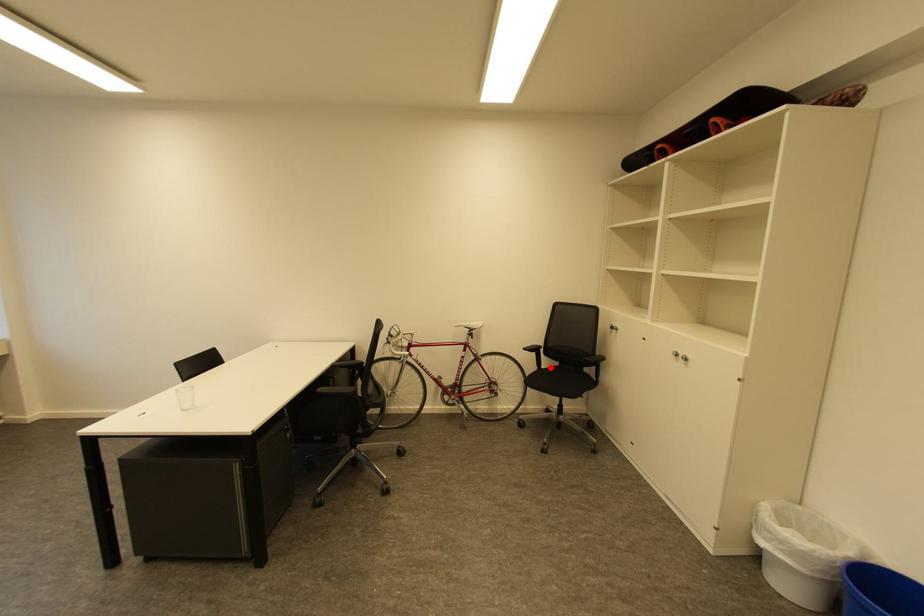
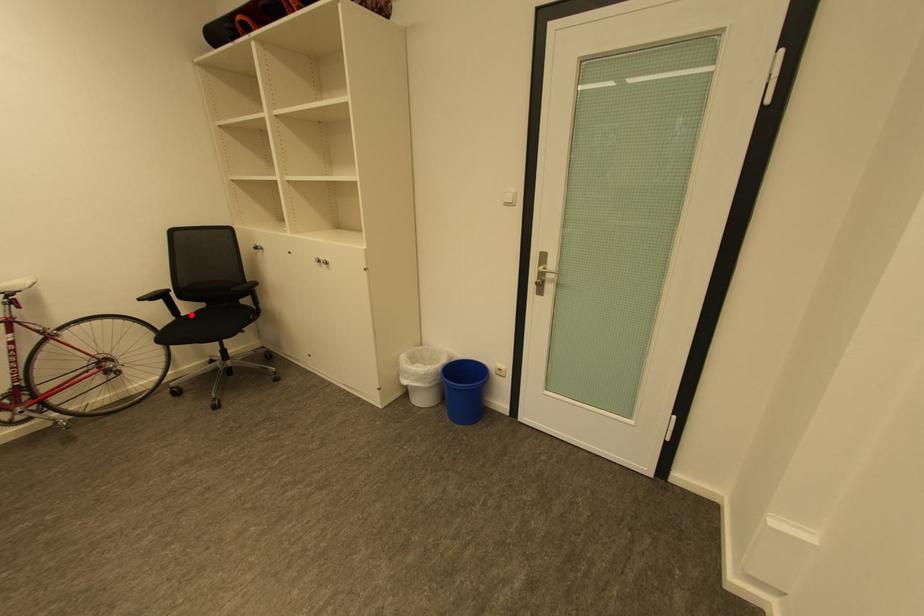
I am providing you with two images of the same scene from different viewpoints. A red point is marked on the first image and another point is marked on the second image. Is the marked point in image1 the same physical position as the marked point in image2?

Yes